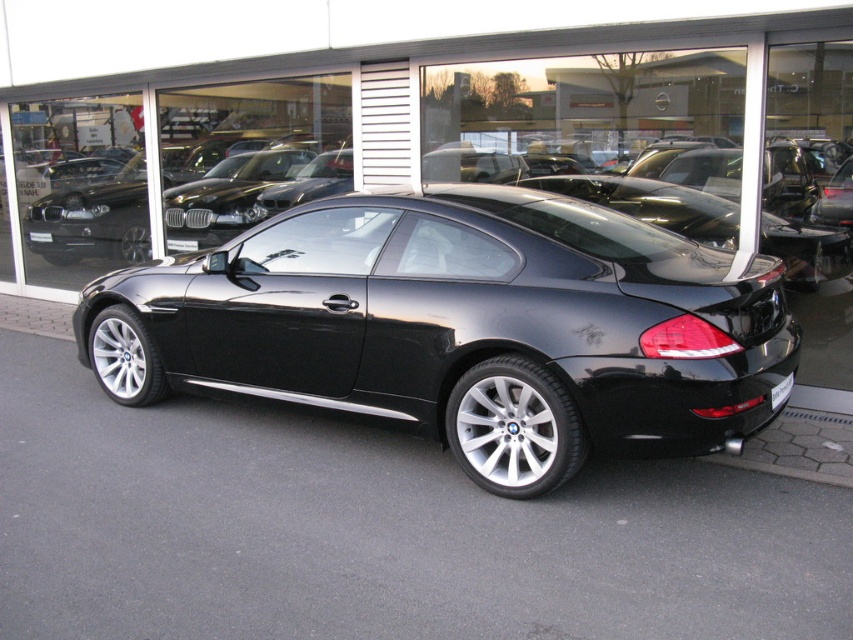
You are a delivery person trying to park a delivery van that is 2 meters wide in the parking lot next to the glossy black car at center and the white plastic license plate at center. Based on their widths, which object can the van safely pass between without touching either?

The glossy black car at center is wider than the white plastic license plate at center. Since the delivery van is 2 meters wide, it can safely pass between them as long as the space between the two objects is wider than 2 meters. However, the exact width of the space isn not provided, so we cannot confirm without additional information.

You are a photographer trying to capture the black metallic car at center without the white plastic license plate at center appearing in the reflection of the car. Is this possible given their positions?

The black metallic car at center is in front of the white plastic license plate at center, so the license plate is behind the car. Since the license plate is behind the car, its reflection would not appear on the car unless the angle allows it. However, the car is positioned at an angle with a clear rear view, so adjusting the camera angle to avoid the reflection might be possible. However, the exact reflection visibility depends on the car surface and lighting, but based on their positions, the license is

You are a delivery person trying to determine if a small package can fit in the trunk of the glossy black car at center without removing the black plastic license plate at rear. Can you confirm if the height of the trunk space is sufficient?

The glossy black car at center has a greater height compared to the black plastic license plate at rear, so the trunk space is likely tall enough to accommodate the package without needing to remove the license plate.